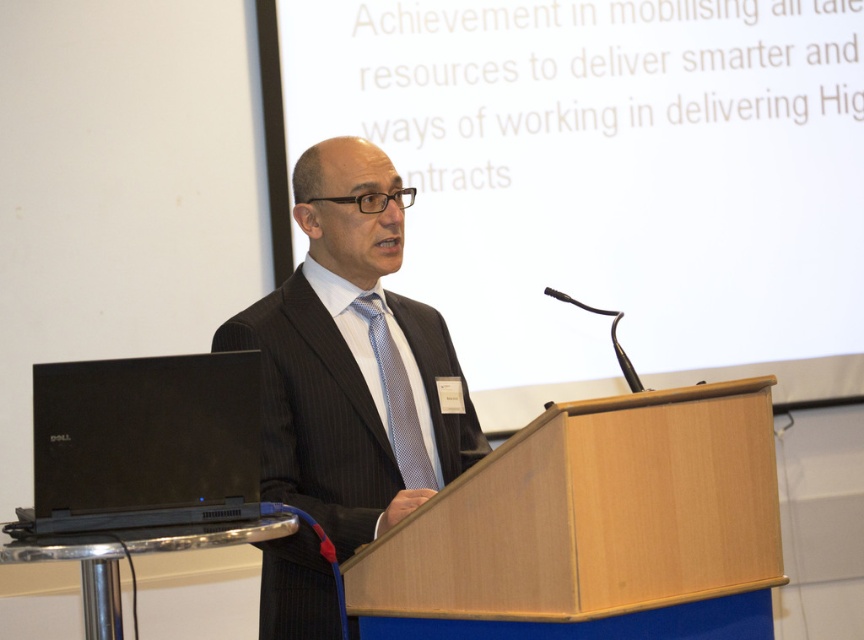
Can you confirm if dark pinstripe suit at center is wider than black matte laptop at lower left?

Yes, dark pinstripe suit at center is wider than black matte laptop at lower left.

Can you confirm if dark pinstripe suit at center is positioned below black matte laptop at lower left?

Incorrect, dark pinstripe suit at center is not positioned below black matte laptop at lower left.

The height and width of the screenshot is (640, 864). I want to click on dark pinstripe suit at center, so click(x=353, y=358).

Locate an element on the screen. Image resolution: width=864 pixels, height=640 pixels. dark pinstripe suit at center is located at coordinates (353, 358).

Is wooden podium at center taller than blue dotted tie at center?

Indeed, wooden podium at center has a greater height compared to blue dotted tie at center.

The image size is (864, 640). Identify the location of wooden podium at center. (592, 525).

Does wooden podium at center have a lesser width compared to dark pinstripe suit at center?

No, wooden podium at center is not thinner than dark pinstripe suit at center.

Does point (691, 552) come behind point (399, 509)?

No, (691, 552) is closer to viewer.

Locate an element on the screen. wooden podium at center is located at coordinates (592, 525).